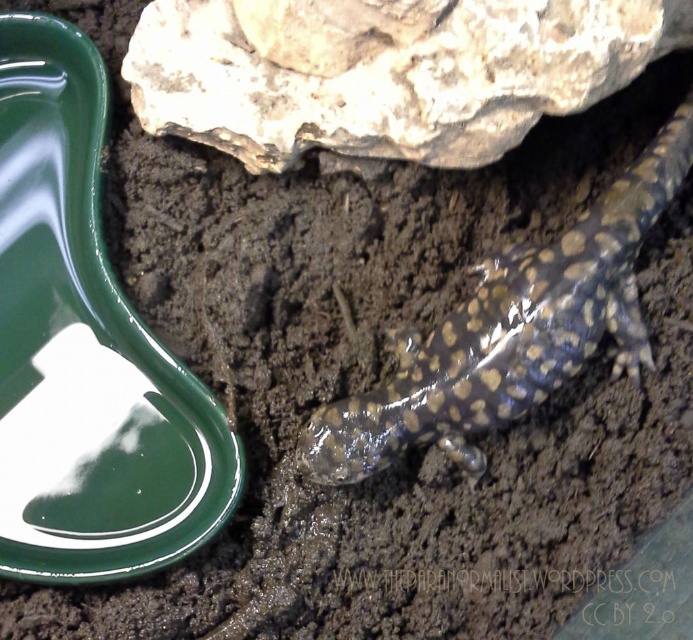
Question: Which of the following is the farthest from the observer?

Choices:
 (A) shiny brown spotted lizard at lower right
 (B) rough textured rock at upper center

Answer: (A)

Question: Is rough textured rock at upper center behind shiny brown spotted lizard at lower right?

Choices:
 (A) yes
 (B) no

Answer: (B)

Question: Which object is farther from the camera taking this photo?

Choices:
 (A) shiny brown spotted lizard at lower right
 (B) rough textured rock at upper center

Answer: (A)

Question: Is rough textured rock at upper center thinner than shiny brown spotted lizard at lower right?

Choices:
 (A) no
 (B) yes

Answer: (A)

Question: Can you confirm if rough textured rock at upper center is positioned to the left of shiny brown spotted lizard at lower right?

Choices:
 (A) no
 (B) yes

Answer: (B)